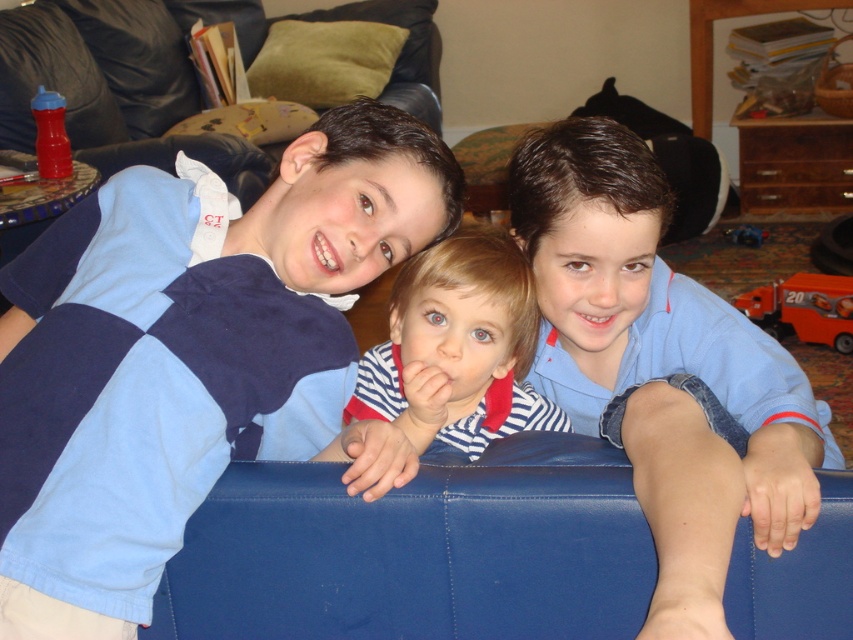
You are a parent trying to locate your child who dropped their rubberized red sippy cup at left and blue plastic toy car at center. Based on the scene, which item is closer to the left edge of the image?

The rubberized red sippy cup at left is positioned on the left side of the blue plastic toy car at center, so it is closer to the left edge of the image.

Where is the blue cotton shirt at upper left located in the image?

The blue cotton shirt at upper left is located at point (189, 358).